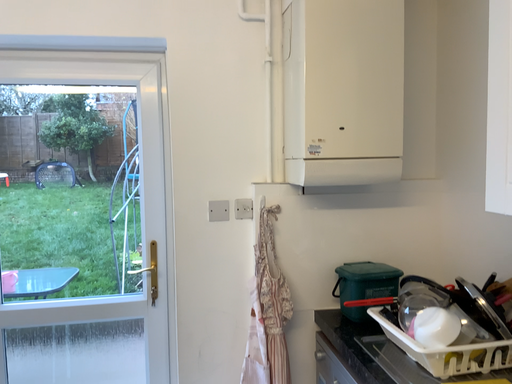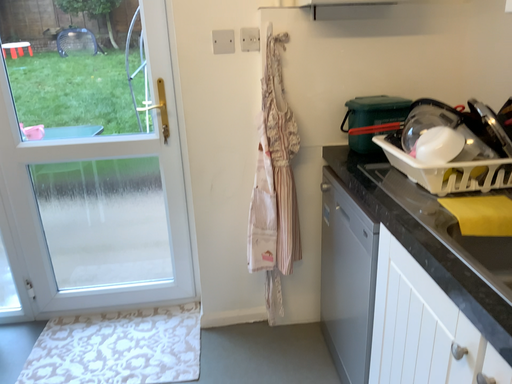
Question: Which way did the camera rotate in the video?

Choices:
 (A) rotated downward
 (B) rotated upward

Answer: (A)